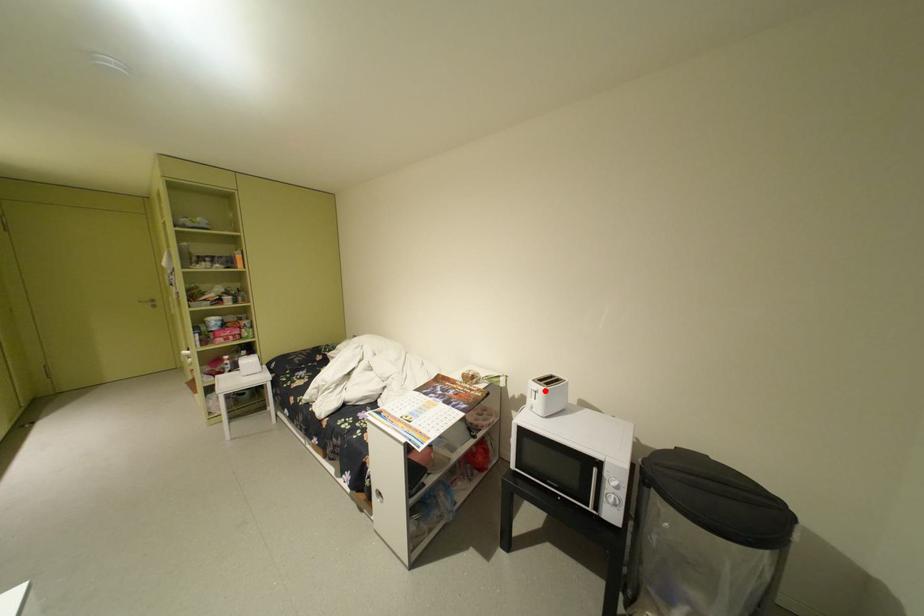
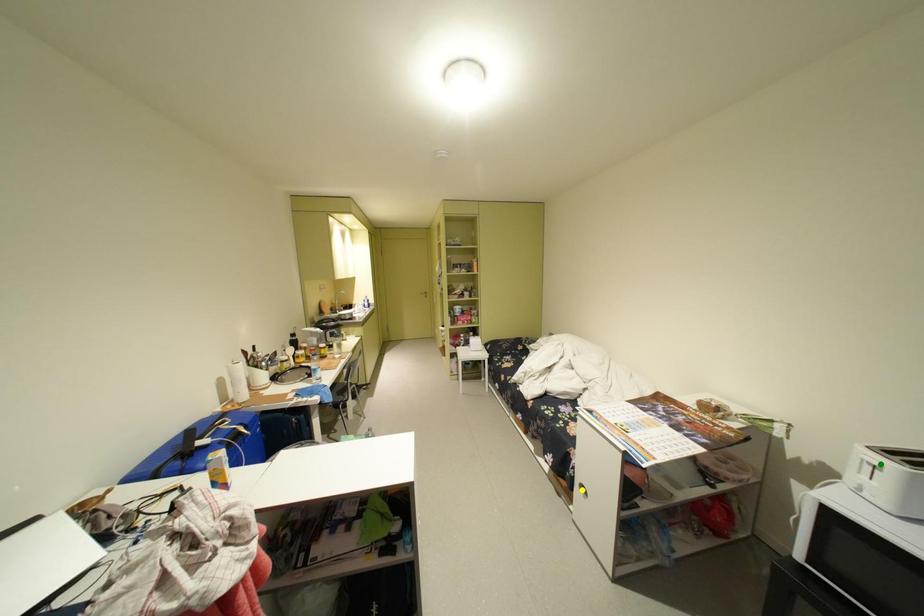
Question: I am providing you with two images of the same scene from different viewpoints. A red point is marked on the first image. You are given multiple points on the second image. Can you choose the point in image 2 that corresponds to the point in image 1?

Choices:
 (A) green point
 (B) blue point
 (C) yellow point

Answer: (A)